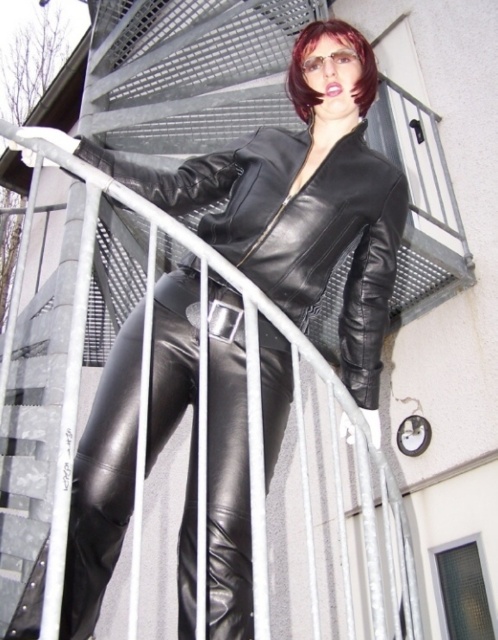
Between black leather jacket at center and shiny dark brown hair at center, which one is positioned higher?

shiny dark brown hair at center is above.

Between point (260, 332) and point (359, 83), which one is positioned in front?

Point (260, 332) is more forward.

Does point (262, 182) come closer to viewer compared to point (317, 93)?

Yes, it is in front of point (317, 93).

This screenshot has height=640, width=498. In order to click on black leather jacket at center in this screenshot , I will do `click(294, 227)`.

Who is positioned more to the right, black leather boot at lower left or shiny dark brown hair at center?

From the viewer's perspective, shiny dark brown hair at center appears more on the right side.

Which is above, black leather boot at lower left or shiny dark brown hair at center?

shiny dark brown hair at center is higher up.

Describe the element at coordinates (93, 540) in the screenshot. I see `black leather boot at lower left` at that location.

The height and width of the screenshot is (640, 498). In order to click on black leather boot at lower left in this screenshot , I will do `click(93, 540)`.

Is black leather jacket at center wider than black leather boot at lower left?

Correct, the width of black leather jacket at center exceeds that of black leather boot at lower left.

Is point (193, 260) positioned in front of point (22, 598)?

No, it is not.

The height and width of the screenshot is (640, 498). In order to click on black leather jacket at center in this screenshot , I will do `click(294, 227)`.